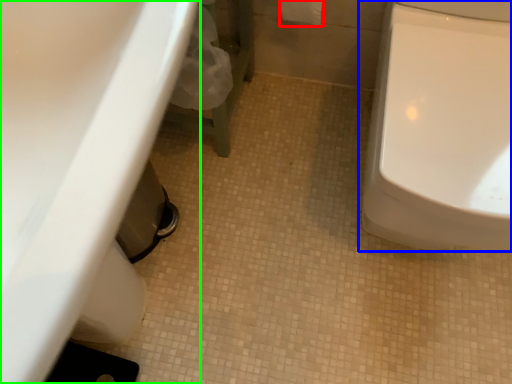
Question: Which is nearer to the toilet paper (highlighted by a red box)? toilet (highlighted by a blue box) or sink (highlighted by a green box).

Choices:
 (A) toilet
 (B) sink

Answer: (A)